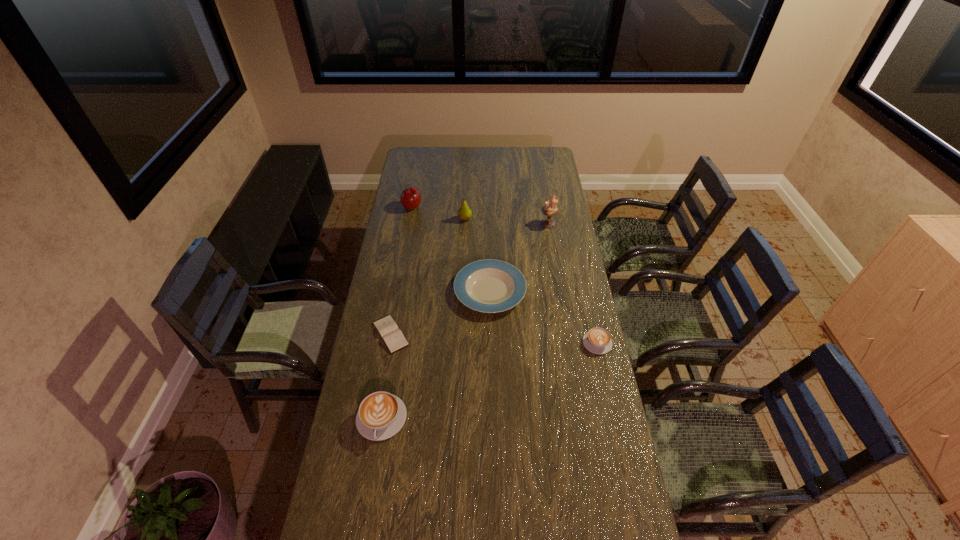
At what (x,y) coordinates should I click in order to perform the action: click on spot to insert another cappuccino for uniform distribution. Please return your answer as a coordinate pair (x, y). This screenshot has width=960, height=540. Looking at the image, I should click on (496, 378).